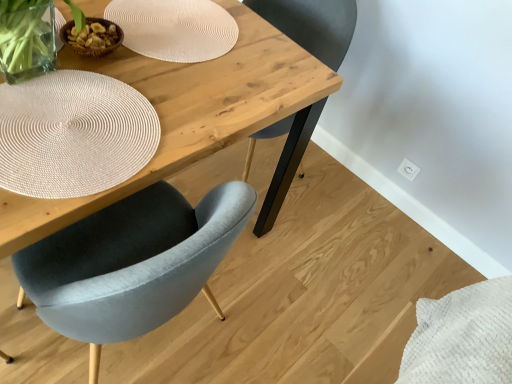
Question: Can you confirm if white textured placemat at upper center, the 2th paper plate viewed from the front, is bigger than natural wood table at center?

Choices:
 (A) no
 (B) yes

Answer: (A)

Question: Is white textured placemat at upper center, which is the second paper plate from bottom to top, outside of natural wood table at center?

Choices:
 (A) yes
 (B) no

Answer: (B)

Question: Does white textured placemat at upper center, the 1th paper plate positioned from the top, come in front of natural wood table at center?

Choices:
 (A) yes
 (B) no

Answer: (B)

Question: From the image's perspective, is white textured placemat at upper center, which is counted as the first paper plate, starting from the back, on top of natural wood table at center?

Choices:
 (A) no
 (B) yes

Answer: (B)

Question: Considering the relative positions of white textured placemat at upper center, which is the second paper plate from bottom to top, and natural wood table at center in the image provided, is white textured placemat at upper center, which is the second paper plate from bottom to top, to the right of natural wood table at center from the viewer's perspective?

Choices:
 (A) no
 (B) yes

Answer: (B)

Question: From a real-world perspective, is white textured placemat at upper center, the 1th paper plate positioned from the top, positioned over natural wood table at center based on gravity?

Choices:
 (A) no
 (B) yes

Answer: (B)

Question: Is velvet grey chair at center smaller than white woven placemat at upper left, which ranks as the 2th paper plate in back-to-front order?

Choices:
 (A) yes
 (B) no

Answer: (B)

Question: From the image's perspective, is velvet grey chair at center on top of white woven placemat at upper left, acting as the 1th paper plate starting from the bottom?

Choices:
 (A) no
 (B) yes

Answer: (B)

Question: Is velvet grey chair at center not inside white woven placemat at upper left, which ranks as the 2th paper plate in back-to-front order?

Choices:
 (A) no
 (B) yes

Answer: (B)

Question: From the image's perspective, is velvet grey chair at center beneath white woven placemat at upper left, which ranks as the 1th paper plate in front-to-back order?

Choices:
 (A) yes
 (B) no

Answer: (B)

Question: From a real-world perspective, is velvet grey chair at center below white woven placemat at upper left, arranged as the second paper plate when viewed from the top?

Choices:
 (A) no
 (B) yes

Answer: (B)

Question: Does velvet grey chair at center have a lesser height compared to white woven placemat at upper left, acting as the 1th paper plate starting from the bottom?

Choices:
 (A) no
 (B) yes

Answer: (A)

Question: Does white woven placemat at upper left, which ranks as the 1th paper plate in front-to-back order, have a lesser height compared to velvet grey chair at center?

Choices:
 (A) yes
 (B) no

Answer: (A)